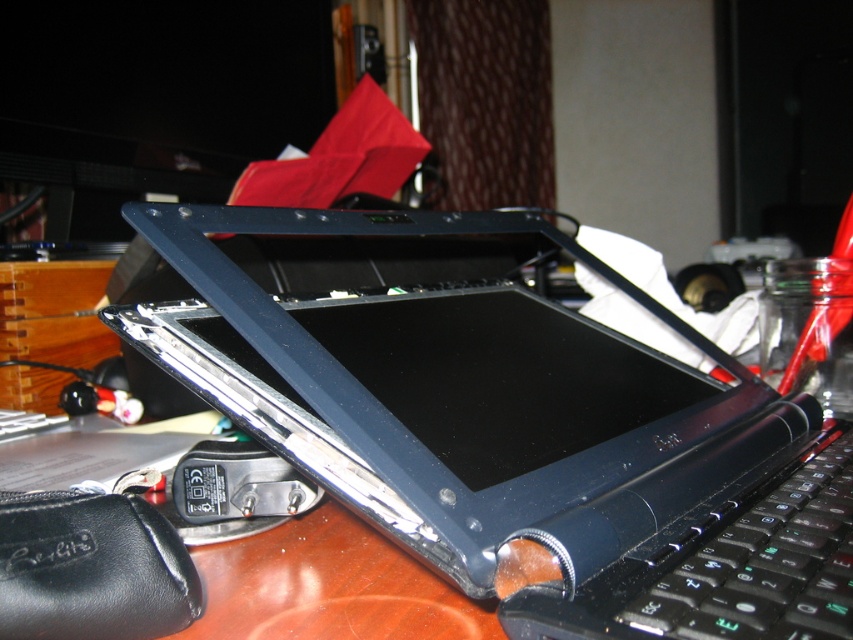
Consider the image. Measure the distance from satin black laptop at center to black matte keyboard at lower right.

They are 5.44 inches apart.

Is satin black laptop at center above black matte keyboard at lower right?

Indeed, satin black laptop at center is positioned over black matte keyboard at lower right.

Identify the location of satin black laptop at center. (508, 429).

At what (x,y) coordinates should I click in order to perform the action: click on satin black laptop at center. Please return your answer as a coordinate pair (x, y). This screenshot has width=853, height=640. Looking at the image, I should click on (508, 429).